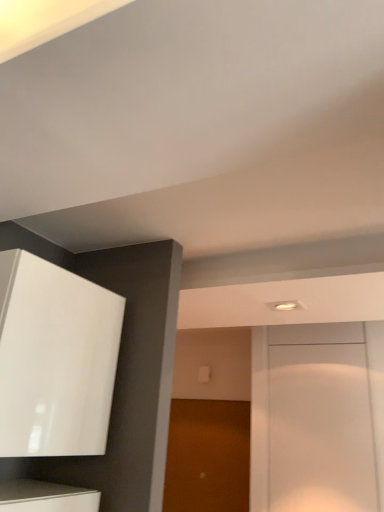
Question: Is brown matte door at center, the 1th door when ordered from back to front, next to white glossy door at center, which ranks as the first door in right-to-left order, and touching it?

Choices:
 (A) no
 (B) yes

Answer: (A)

Question: From the image's perspective, is brown matte door at center, the 1th door when ordered from back to front, above white glossy door at center, which ranks as the first door in right-to-left order?

Choices:
 (A) no
 (B) yes

Answer: (A)

Question: Considering the relative sizes of brown matte door at center, the second door viewed from the front, and white glossy door at center, which ranks as the second door in back-to-front order, in the image provided, is brown matte door at center, the second door viewed from the front, bigger than white glossy door at center, which ranks as the second door in back-to-front order,?

Choices:
 (A) yes
 (B) no

Answer: (A)

Question: Is brown matte door at center, which is counted as the 1th door, starting from the left, outside of white glossy door at center, which ranks as the second door in back-to-front order?

Choices:
 (A) yes
 (B) no

Answer: (A)

Question: Is brown matte door at center, which is counted as the 1th door, starting from the left, positioned with its back to white glossy door at center, which ranks as the first door in right-to-left order?

Choices:
 (A) no
 (B) yes

Answer: (A)

Question: Considering the positions of glossy white cabinet at upper left and brown matte door at center, the second door positioned from the right, in the image, is glossy white cabinet at upper left bigger or smaller than brown matte door at center, the second door positioned from the right,?

Choices:
 (A) big
 (B) small

Answer: (A)

Question: From a real-world perspective, is glossy white cabinet at upper left positioned above or below brown matte door at center, the 1th door when ordered from back to front?

Choices:
 (A) below
 (B) above

Answer: (B)

Question: Is glossy white cabinet at upper left taller or shorter than brown matte door at center, the 1th door when ordered from back to front?

Choices:
 (A) tall
 (B) short

Answer: (B)

Question: Relative to brown matte door at center, the 1th door when ordered from back to front, is glossy white cabinet at upper left in front or behind?

Choices:
 (A) behind
 (B) front

Answer: (B)

Question: Based on their sizes in the image, would you say white glossy door at center, the 2th door from the left, is bigger or smaller than glossy white cabinet at upper left?

Choices:
 (A) small
 (B) big

Answer: (A)

Question: Is white glossy door at center, the 2th door from the left, situated inside glossy white cabinet at upper left or outside?

Choices:
 (A) inside
 (B) outside

Answer: (B)

Question: Is point (362, 440) closer or farther from the camera than point (46, 448)?

Choices:
 (A) closer
 (B) farther

Answer: (B)

Question: In the image, is white glossy door at center, which ranks as the second door in back-to-front order, on the left side or the right side of glossy white cabinet at upper left?

Choices:
 (A) right
 (B) left

Answer: (A)

Question: Considering the positions of brown matte door at center, the 1th door when ordered from back to front, and white glossy door at center, which ranks as the second door in back-to-front order, in the image, is brown matte door at center, the 1th door when ordered from back to front, wider or thinner than white glossy door at center, which ranks as the second door in back-to-front order,?

Choices:
 (A) thin
 (B) wide

Answer: (B)

Question: From the image's perspective, is brown matte door at center, the 1th door when ordered from back to front, above or below white glossy door at center, placed as the first door when sorted from front to back?

Choices:
 (A) below
 (B) above

Answer: (A)